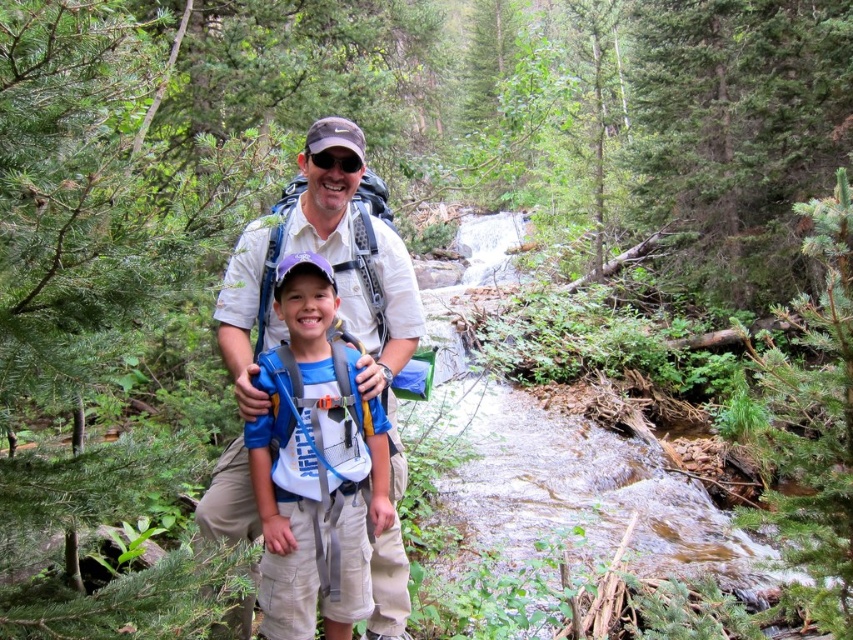
You are a hiker who wants to place a 1.2 meter long tent pole between the blue fabric backpack at center and the black matte sunglasses at center. Can you fit the tent pole between them without bending it?

The blue fabric backpack at center and black matte sunglasses at center are 1.05 meters apart, which is shorter than the 1.2 meter tent pole. Therefore, the tent pole cannot be placed between them without bending it.

You are a photographer trying to capture a candid shot of the light beige cotton shirt at center and the black matte sunglasses at center. Since you want to ensure both are in focus, you need to know their relative sizes. Which object is taller?

The light beige cotton shirt at center is much taller than the black matte sunglasses at center, so you should focus on the light beige cotton shirt at center first as it is larger.